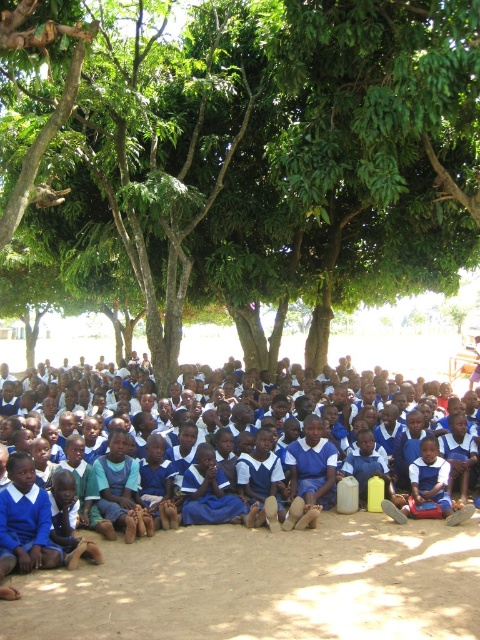
You are a photographer trying to capture the children under the trees. If you want to focus on the blue fabric uniform at center without the green leafy tree at center blocking the view, which direction should you move your camera?

You should move your camera forward because the green leafy tree at center is closer to the viewer than the blue fabric uniform at center, so moving forward will reduce the tree blocking the uniform.

You are a photographer trying to capture a group photo of the children. The green leafy tree at center and the blue fabric uniform at center are both in the frame. Which object takes up more space in the photo?

The green leafy tree at center might be wider than the blue fabric uniform at center, so the green leafy tree at center likely occupies more space in the photo.